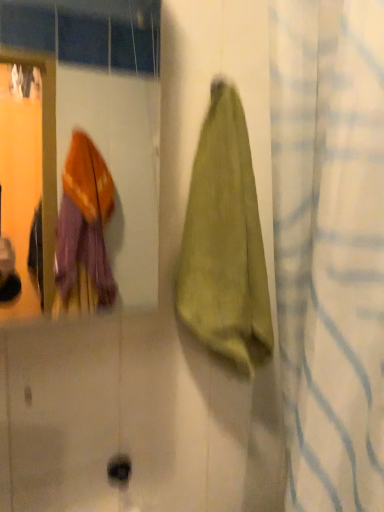
Question: Is green fabric towel at center positioned with its back to green fabric towel at right?

Choices:
 (A) no
 (B) yes

Answer: (A)

Question: Is green fabric towel at center at the left side of green fabric towel at right?

Choices:
 (A) yes
 (B) no

Answer: (A)

Question: Is green fabric towel at center smaller than green fabric towel at right?

Choices:
 (A) no
 (B) yes

Answer: (B)

Question: Would you say green fabric towel at center is a long distance from green fabric towel at right?

Choices:
 (A) yes
 (B) no

Answer: (B)

Question: Is green fabric towel at center beside green fabric towel at right?

Choices:
 (A) yes
 (B) no

Answer: (B)

Question: Does green fabric towel at center appear on the right side of green fabric towel at right?

Choices:
 (A) yes
 (B) no

Answer: (B)

Question: Does green fabric towel at right lie in front of green fabric towel at center?

Choices:
 (A) yes
 (B) no

Answer: (A)

Question: Is green fabric towel at center at the back of green fabric towel at right?

Choices:
 (A) yes
 (B) no

Answer: (A)

Question: Does green fabric towel at right have a smaller size compared to green fabric towel at center?

Choices:
 (A) no
 (B) yes

Answer: (A)

Question: Can you confirm if green fabric towel at right is thinner than green fabric towel at center?

Choices:
 (A) yes
 (B) no

Answer: (B)

Question: Is the depth of green fabric towel at right greater than that of green fabric towel at center?

Choices:
 (A) yes
 (B) no

Answer: (B)

Question: Could you tell me if green fabric towel at right is turned towards green fabric towel at center?

Choices:
 (A) no
 (B) yes

Answer: (B)

Question: Does point (301, 507) appear closer or farther from the camera than point (221, 352)?

Choices:
 (A) closer
 (B) farther

Answer: (A)